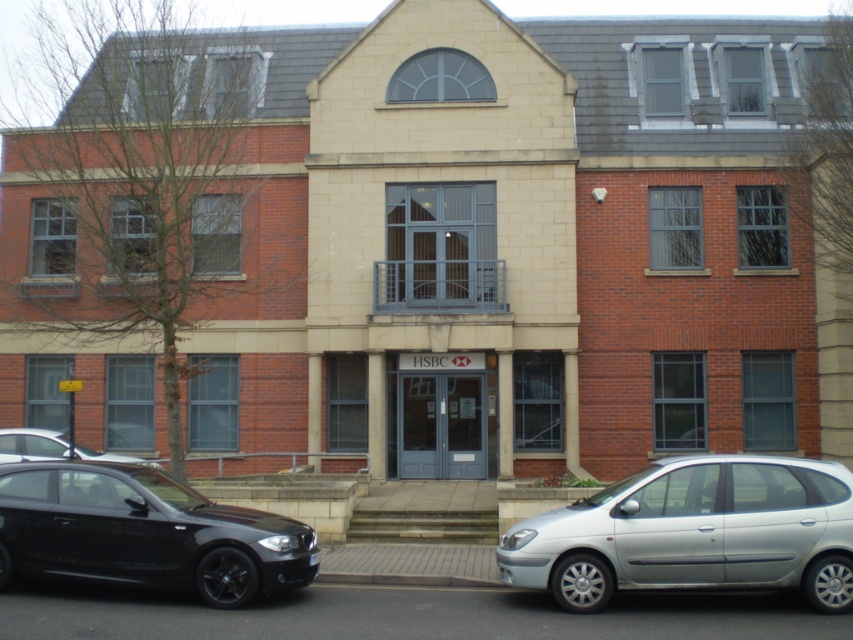
You are a delivery person approaching the HSBC building and see the shiny black car at lower left and the shiny black sedan at lower left. Which vehicle is positioned higher up from the ground?

The shiny black car at lower left is above the shiny black sedan at lower left, so the shiny black car at lower left is positioned higher up from the ground.

You are a delivery person needing to park your van next to the shiny black car at lower left without blocking the silver metallic hatchback at lower right. Can you fit your van between them?

The silver metallic hatchback at lower right is smaller than the shiny black car at lower left, so there might be enough space between them for your van. However, since the hatchback is smaller, it might not obstruct the parking space. Please ensure there is sufficient space before parking.

You are a delivery driver who needs to park your vehicle in front of the HSBC bank building. You see a silver metallic hatchback at lower right and a shiny black sedan at lower left. Which parking spot is closer to the entrance of the building?

The silver metallic hatchback at lower right is positioned over the shiny black sedan at lower left, meaning it is closer to the entrance of the HSBC bank building.